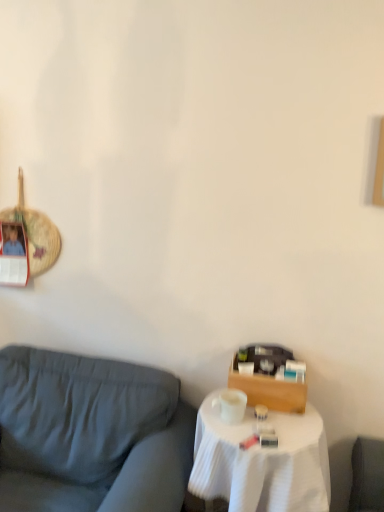
Question: Would you say white cloth-covered table at lower right is part of matte gray fabric couch at left's contents?

Choices:
 (A) no
 (B) yes

Answer: (A)

Question: Is matte gray fabric couch at left aimed at white cloth-covered table at lower right?

Choices:
 (A) yes
 (B) no

Answer: (B)

Question: Can you confirm if matte gray fabric couch at left is positioned to the right of white cloth-covered table at lower right?

Choices:
 (A) no
 (B) yes

Answer: (A)

Question: Is matte gray fabric couch at left bigger than white cloth-covered table at lower right?

Choices:
 (A) yes
 (B) no

Answer: (A)

Question: From a real-world perspective, is matte gray fabric couch at left under white cloth-covered table at lower right?

Choices:
 (A) no
 (B) yes

Answer: (A)

Question: From a real-world perspective, does matte gray fabric couch at left stand above white cloth-covered table at lower right?

Choices:
 (A) no
 (B) yes

Answer: (B)

Question: From a real-world perspective, is white cloth-covered table at lower right below matte gray fabric couch at left?

Choices:
 (A) no
 (B) yes

Answer: (B)

Question: From the image's perspective, is white cloth-covered table at lower right over matte gray fabric couch at left?

Choices:
 (A) no
 (B) yes

Answer: (A)

Question: Is white cloth-covered table at lower right not close to matte gray fabric couch at left?

Choices:
 (A) yes
 (B) no

Answer: (B)

Question: Does white cloth-covered table at lower right come in front of matte gray fabric couch at left?

Choices:
 (A) yes
 (B) no

Answer: (B)

Question: From a real-world perspective, is white cloth-covered table at lower right physically above matte gray fabric couch at left?

Choices:
 (A) yes
 (B) no

Answer: (B)

Question: Can you confirm if white cloth-covered table at lower right is bigger than matte gray fabric couch at left?

Choices:
 (A) no
 (B) yes

Answer: (A)

Question: Is point (105, 504) closer or farther from the camera than point (269, 417)?

Choices:
 (A) closer
 (B) farther

Answer: (A)